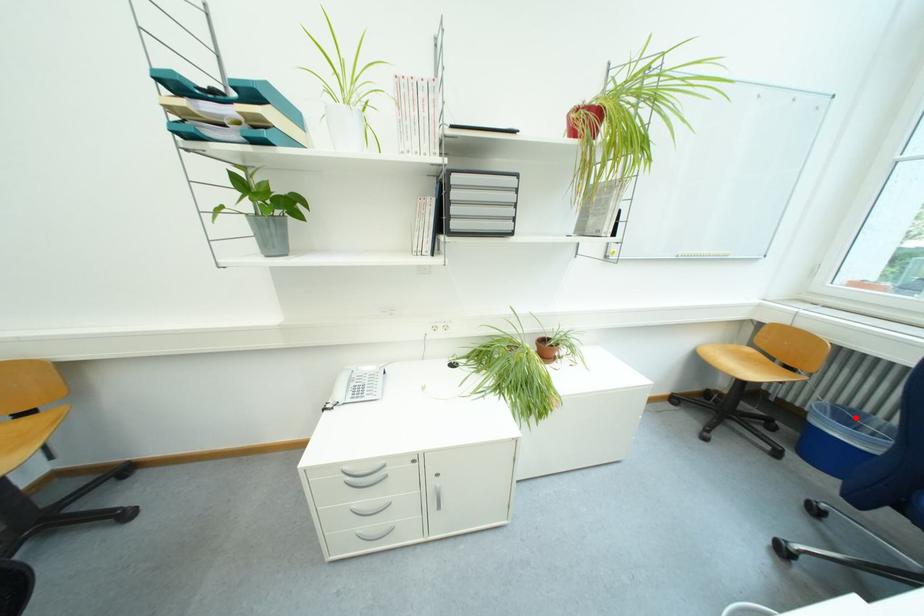
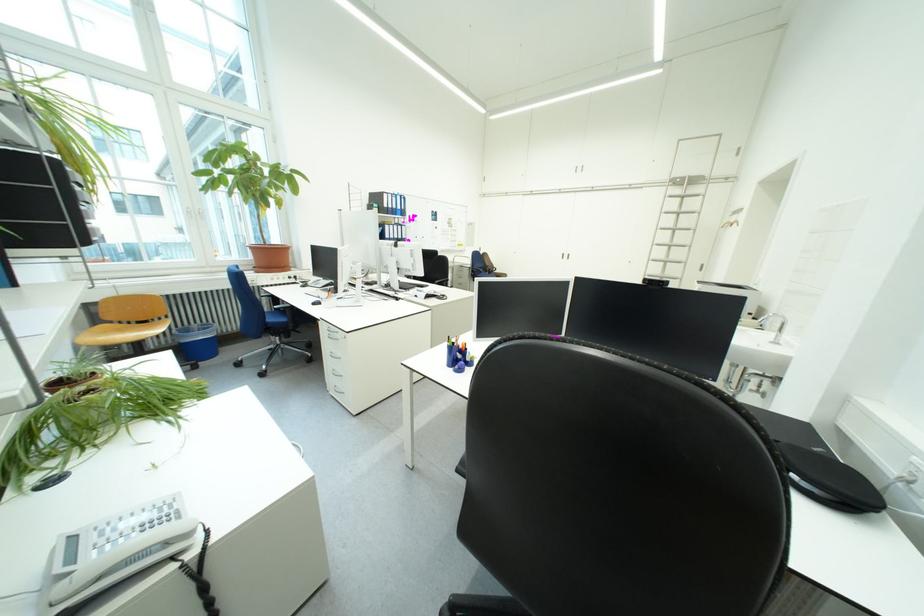
Question: I am providing you with two images of the same scene from different viewpoints. Given a red point in image1, look at the same physical point in image2. Is it:

Choices:
 (A) Closer to the viewpoint
 (B) Farther from the viewpoint

Answer: (A)